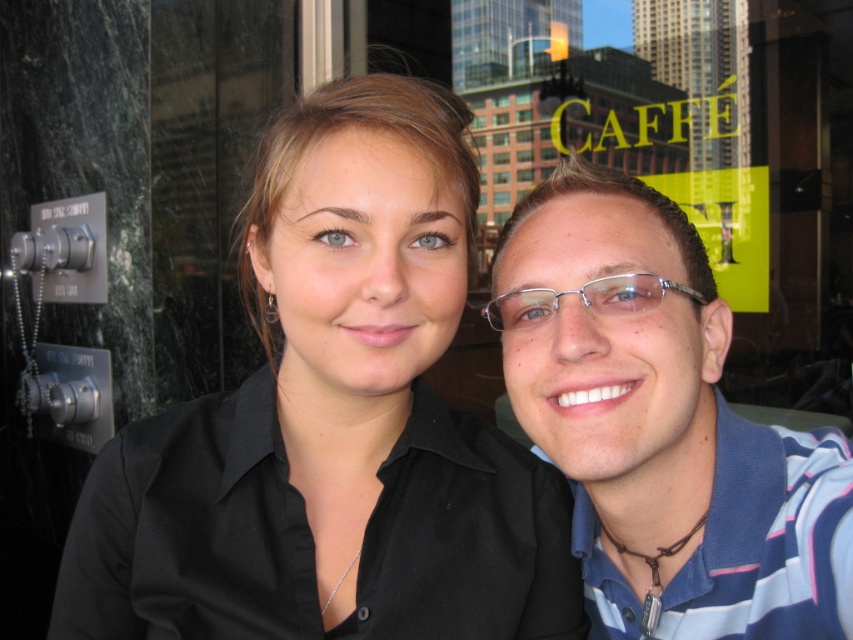
Question: Does blue striped polo shirt at right appear on the right side of metallic frame glasses at center?

Choices:
 (A) no
 (B) yes

Answer: (B)

Question: Is black matte shirt at center above blue striped polo shirt at right?

Choices:
 (A) no
 (B) yes

Answer: (B)

Question: Which of these objects is positioned closest to the black matte shirt at center?

Choices:
 (A) blue striped polo shirt at right
 (B) metallic frame glasses at center

Answer: (A)

Question: Among these points, which one is farthest from the camera?

Choices:
 (A) (497, 328)
 (B) (724, 634)

Answer: (A)

Question: Is black matte shirt at center below metallic frame glasses at center?

Choices:
 (A) no
 (B) yes

Answer: (B)

Question: Among these objects, which one is farthest from the camera?

Choices:
 (A) black matte shirt at center
 (B) blue striped polo shirt at right
 (C) metallic frame glasses at center

Answer: (C)